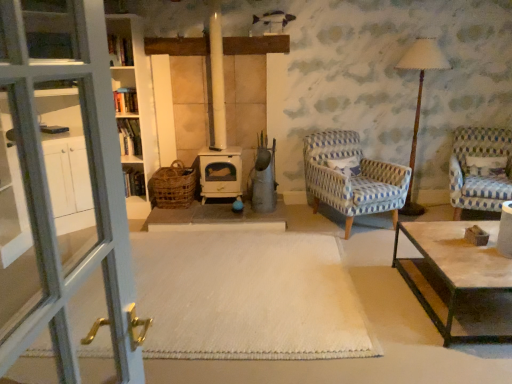
Question: Should I look upward or downward to see blue and white checkered fabric armchair at right, the 1th chair from the right?

Choices:
 (A) down
 (B) up

Answer: (B)

Question: Is white carpet at center next to rustic wicker basket at center?

Choices:
 (A) no
 (B) yes

Answer: (A)

Question: Is white carpet at center further to the viewer compared to rustic wicker basket at center?

Choices:
 (A) no
 (B) yes

Answer: (A)

Question: Considering the relative sizes of white carpet at center and rustic wicker basket at center in the image provided, is white carpet at center taller than rustic wicker basket at center?

Choices:
 (A) no
 (B) yes

Answer: (A)

Question: Is white carpet at center not close to rustic wicker basket at center?

Choices:
 (A) yes
 (B) no

Answer: (A)

Question: Is white carpet at center to the right of rustic wicker basket at center from the viewer's perspective?

Choices:
 (A) no
 (B) yes

Answer: (B)

Question: Can you confirm if white carpet at center is shorter than rustic wicker basket at center?

Choices:
 (A) no
 (B) yes

Answer: (B)

Question: Does wooden table lamp at right have a lesser width compared to white textured pillow at right?

Choices:
 (A) no
 (B) yes

Answer: (A)

Question: Does wooden table lamp at right lie in front of white textured pillow at right?

Choices:
 (A) no
 (B) yes

Answer: (B)

Question: Could you tell me if wooden table lamp at right is facing white textured pillow at right?

Choices:
 (A) yes
 (B) no

Answer: (B)

Question: Does wooden table lamp at right have a smaller size compared to white textured pillow at right?

Choices:
 (A) no
 (B) yes

Answer: (A)

Question: Can you confirm if wooden table lamp at right is positioned to the left of white textured pillow at right?

Choices:
 (A) no
 (B) yes

Answer: (B)

Question: Does wooden table lamp at right touch white textured pillow at right?

Choices:
 (A) no
 (B) yes

Answer: (A)

Question: Can you confirm if rustic wicker basket at center is smaller than wooden bookshelf at center?

Choices:
 (A) yes
 (B) no

Answer: (B)